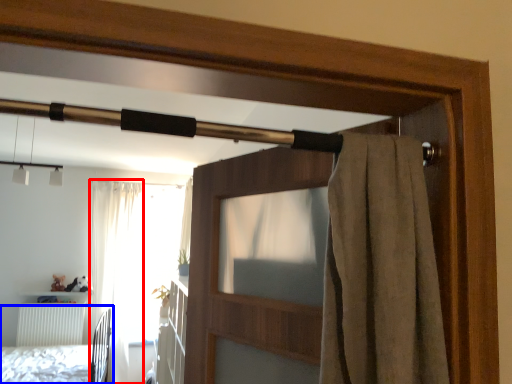
Question: Which object is further to the camera taking this photo, curtain (highlighted by a red box) or bed (highlighted by a blue box)?

Choices:
 (A) curtain
 (B) bed

Answer: (A)